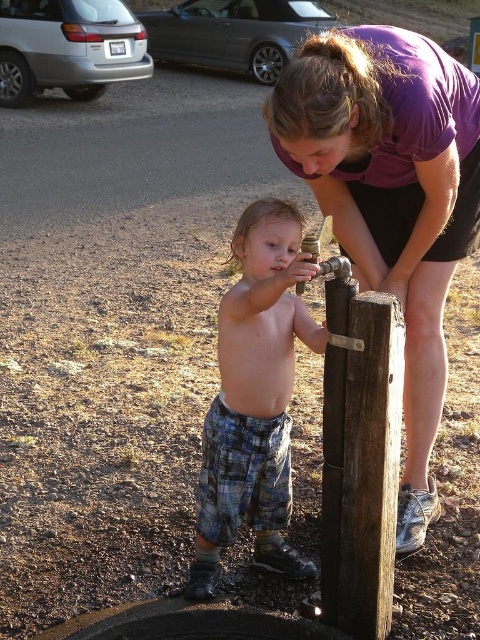
Question: Can you confirm if plaid pants at center is smaller than silver metallic van at upper left?

Choices:
 (A) yes
 (B) no

Answer: (A)

Question: In this image, where is purple fabric shirt at upper center located relative to silver metallic van at upper left?

Choices:
 (A) left
 (B) right

Answer: (B)

Question: Estimate the real-world distances between objects in this image. Which object is closer to the brushed metal car at upper center?

Choices:
 (A) brown wooden post at center
 (B) silver metallic van at upper left
 (C) purple fabric shirt at upper center
 (D) plaid pants at center

Answer: (B)

Question: Is plaid pants at center to the right of silver metallic van at upper left from the viewer's perspective?

Choices:
 (A) yes
 (B) no

Answer: (A)

Question: Which object appears farthest from the camera in this image?

Choices:
 (A) silver metallic van at upper left
 (B) plaid pants at center
 (C) purple fabric shirt at upper center

Answer: (A)

Question: Which object is positioned farthest from the purple fabric shirt at upper center?

Choices:
 (A) brown wooden post at center
 (B) plaid pants at center
 (C) brushed metal car at upper center

Answer: (C)